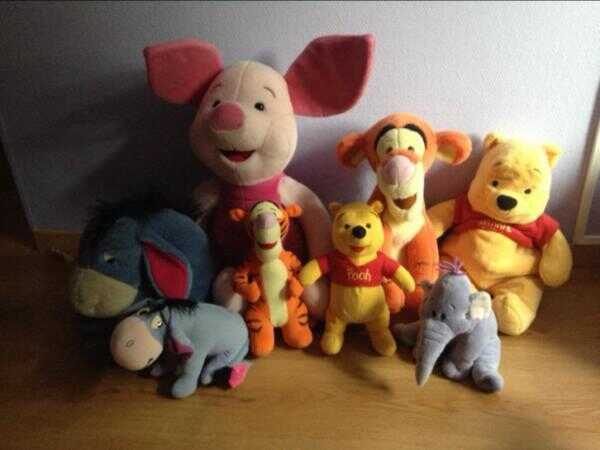
Identify the location of plush dolls. (123, 273), (197, 326), (243, 146), (268, 261), (356, 251), (416, 189), (505, 194), (456, 311).